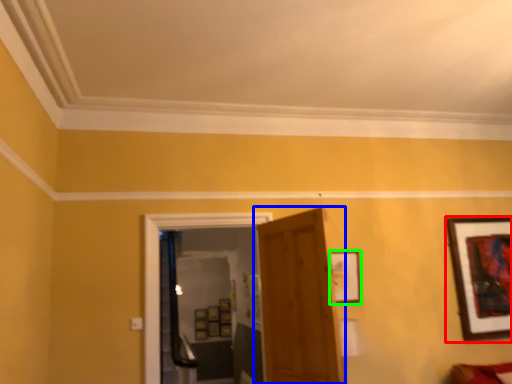
Question: Considering the real-world distances, which object is farthest from picture frame (highlighted by a red box)? door (highlighted by a blue box) or picture frame (highlighted by a green box)?

Choices:
 (A) door
 (B) picture frame

Answer: (A)